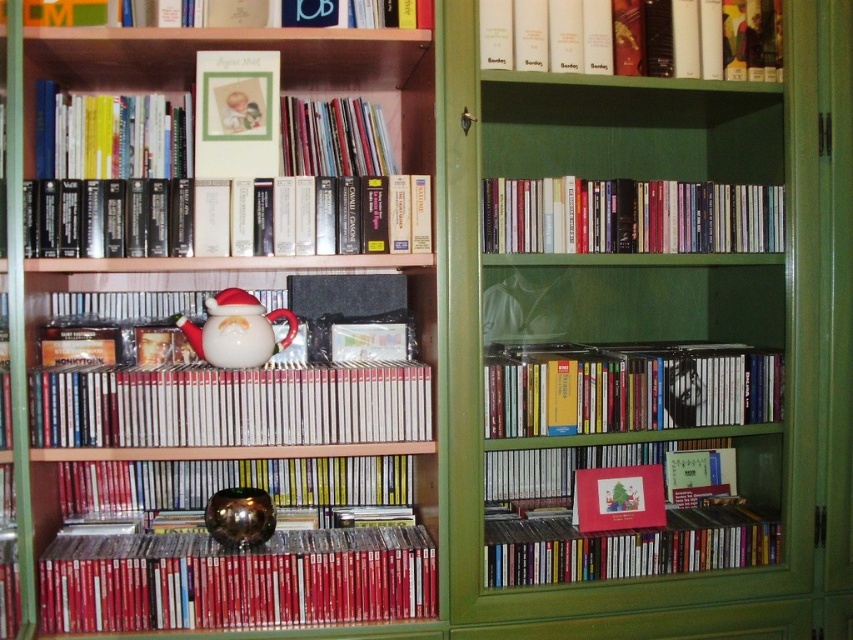
You are a delivery person who needs to place a small package on the shelf closest to the front. You see two points marked on the image, point (606,81) and point (383,163). Which point is closer to you and suitable for placing the package?

Point (606,81) is in front of point (383,163), so placing the package at point (606,81) would be closer to you and suitable.

You are organizing items on a bookshelf and want to place a new item between the metallic gold bowl at center and the hardcover book at center. Based on their current positions, where should you place the new item?

The metallic gold bowl at center is located below the hardcover book at center, so you should place the new item between them either above the bowl or below the book depending on the available space.